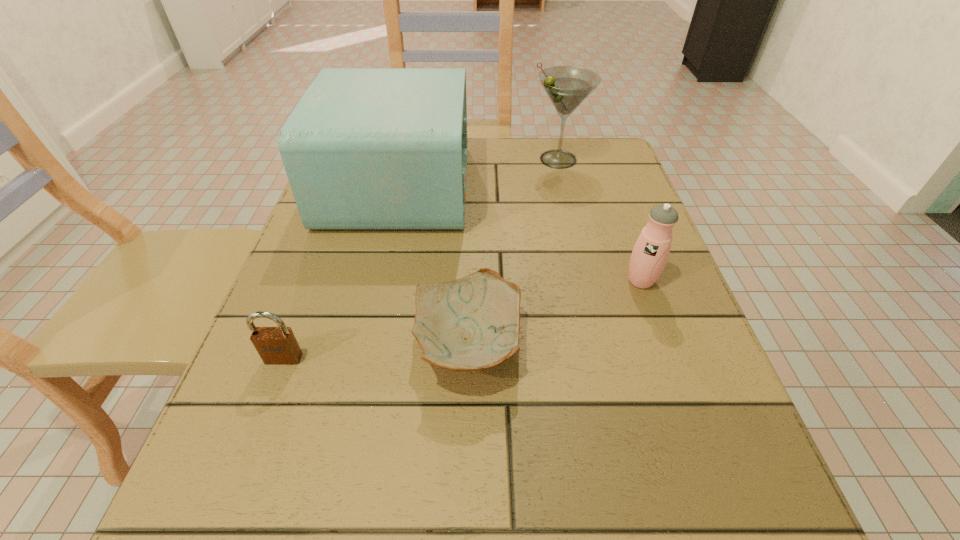
This screenshot has width=960, height=540. What are the coordinates of `free spot located on the back of the pottery` in the screenshot? It's located at (471, 209).

Identify the location of martini located in the far edge section of the desktop. (567, 87).

The width and height of the screenshot is (960, 540). I want to click on radio receiver that is positioned at the far edge, so click(x=365, y=148).

You are a GUI agent. You are given a task and a screenshot of the screen. Output one action in this format:
    pyautogui.click(x=<x>, y=<y>)
    Task: Click on the radio receiver that is at the left edge
    This screenshot has height=540, width=960.
    Given the screenshot: What is the action you would take?
    [365, 148]

At what (x,y) coordinates should I click in order to perform the action: click on padlock positioned at the left edge. Please return your answer as a coordinate pair (x, y). The image size is (960, 540). Looking at the image, I should click on (275, 345).

This screenshot has height=540, width=960. Find the location of `martini at the right edge`. martini at the right edge is located at coordinates (567, 87).

At what (x,y) coordinates should I click in order to perform the action: click on thermos bottle that is at the right edge. Please return your answer as a coordinate pair (x, y). Image resolution: width=960 pixels, height=540 pixels. Looking at the image, I should click on (649, 256).

Where is `object located in the far left corner section of the desktop`? This screenshot has height=540, width=960. object located in the far left corner section of the desktop is located at coordinates [365, 148].

Where is `object that is at the far right corner`? Image resolution: width=960 pixels, height=540 pixels. object that is at the far right corner is located at coordinates tap(567, 87).

You are a GUI agent. You are given a task and a screenshot of the screen. Output one action in this format:
    pyautogui.click(x=<x>, y=<y>)
    Task: Click on the free space at the far edge
    The height and width of the screenshot is (540, 960).
    Given the screenshot: What is the action you would take?
    pyautogui.click(x=490, y=145)